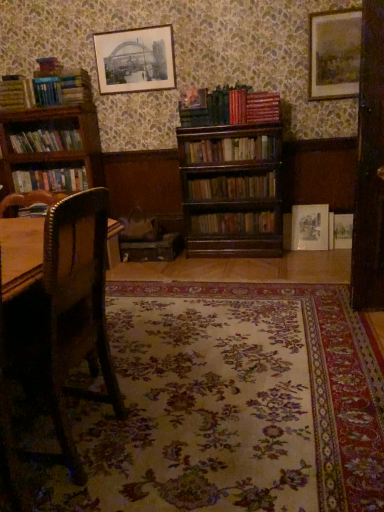
Question: Can you confirm if hardcover books at left, the 5th book from the top, is positioned to the right of matte paper picture frame at upper right, the second picture frame viewed from the right?

Choices:
 (A) yes
 (B) no

Answer: (B)

Question: Can we say hardcover books at left, the 5th book from the top, lies outside matte paper picture frame at upper right, the 3th picture frame from the top?

Choices:
 (A) yes
 (B) no

Answer: (A)

Question: Is hardcover books at left, arranged as the third book when ordered from the bottom, not near matte paper picture frame at upper right, which is counted as the 2th picture frame, starting from the left?

Choices:
 (A) no
 (B) yes

Answer: (B)

Question: From a real-world perspective, is hardcover books at left, arranged as the third book when ordered from the bottom, located beneath matte paper picture frame at upper right, the first picture frame from the bottom?

Choices:
 (A) yes
 (B) no

Answer: (B)

Question: Can you confirm if hardcover books at left, arranged as the third book when ordered from the bottom, is wider than matte paper picture frame at upper right, which is counted as the 2th picture frame, starting from the left?

Choices:
 (A) no
 (B) yes

Answer: (B)

Question: In the image, is wooden bookshelf at center, which is the 1th book in bottom-to-top order, positioned in front of or behind wooden bookshelf at left, acting as the 3th book starting from the top?

Choices:
 (A) behind
 (B) front

Answer: (B)

Question: Is point (248, 220) positioned closer to the camera than point (72, 139)?

Choices:
 (A) closer
 (B) farther

Answer: (A)

Question: Is wooden bookshelf at center, marked as the seventh book in a top-to-bottom arrangement, spatially inside wooden bookshelf at left, acting as the 3th book starting from the top, or outside of it?

Choices:
 (A) inside
 (B) outside

Answer: (B)

Question: In terms of width, does wooden bookshelf at center, which is the 1th book in bottom-to-top order, look wider or thinner when compared to wooden bookshelf at left, which is the 5th book in bottom-to-top order?

Choices:
 (A) wide
 (B) thin

Answer: (B)

Question: Considering the positions of matte paper picture frame at upper right, the 3th picture frame from the top, and matte paper picture frame at upper center, placed as the third picture frame when sorted from right to left, in the image, is matte paper picture frame at upper right, the 3th picture frame from the top, taller or shorter than matte paper picture frame at upper center, placed as the third picture frame when sorted from right to left,?

Choices:
 (A) tall
 (B) short

Answer: (B)

Question: Considering the positions of point (322, 244) and point (134, 44), is point (322, 244) closer or farther from the camera than point (134, 44)?

Choices:
 (A) farther
 (B) closer

Answer: (A)

Question: In the image, is matte paper picture frame at upper right, the first picture frame from the bottom, on the left side or the right side of matte paper picture frame at upper center, placed as the third picture frame when sorted from right to left?

Choices:
 (A) left
 (B) right

Answer: (B)

Question: Choose the correct answer: Is matte paper picture frame at upper right, the second picture frame viewed from the right, inside matte paper picture frame at upper center, arranged as the first picture frame when viewed from the left, or outside it?

Choices:
 (A) inside
 (B) outside

Answer: (B)

Question: From the image's perspective, relative to wooden bookshelf at left, acting as the 3th book starting from the top, is wooden bookshelf at center, which ranks as the fourth book in bottom-to-top order, above or below?

Choices:
 (A) below
 (B) above

Answer: (A)

Question: From a real-world perspective, is wooden bookshelf at center, which ranks as the fourth book in bottom-to-top order, above or below wooden bookshelf at left, acting as the 3th book starting from the top?

Choices:
 (A) below
 (B) above

Answer: (A)